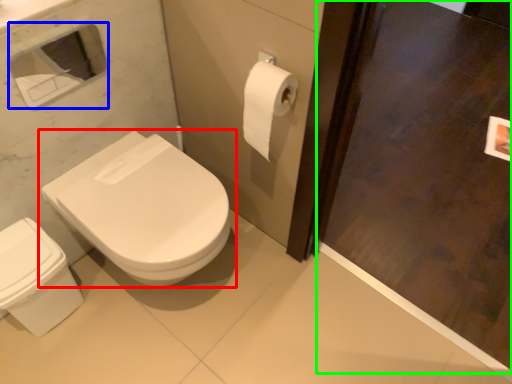
Question: Which is nearer to the toilet (highlighted by a red box)? medicine cabinet (highlighted by a blue box) or screen door (highlighted by a green box).

Choices:
 (A) medicine cabinet
 (B) screen door

Answer: (B)